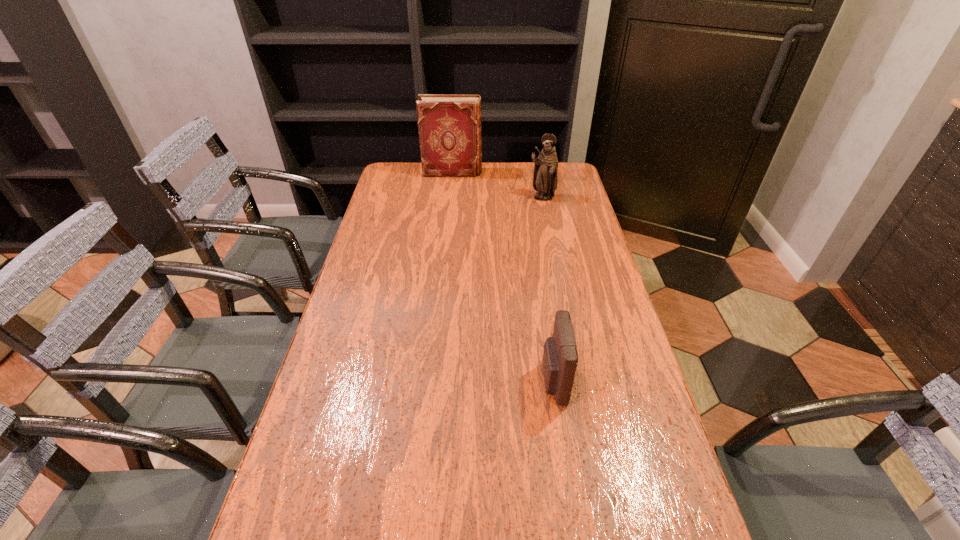
Locate an element on the screen. The height and width of the screenshot is (540, 960). the tallest object is located at coordinates (449, 126).

Locate an element on the screen. The image size is (960, 540). the farthest object is located at coordinates (449, 126).

At what (x,y) coordinates should I click in order to perform the action: click on the second tallest object. Please return your answer as a coordinate pair (x, y). This screenshot has width=960, height=540. Looking at the image, I should click on (545, 179).

You are a GUI agent. You are given a task and a screenshot of the screen. Output one action in this format:
    pyautogui.click(x=<x>, y=<y>)
    Task: Click on the second farthest object
    
    Given the screenshot: What is the action you would take?
    pyautogui.click(x=545, y=179)

Identify the location of the shortest object. (560, 358).

Locate an element on the screen. pouch is located at coordinates (560, 358).

At what (x,y) coordinates should I click in order to perform the action: click on free space located 0.250m on the spine side of the hardback book. Please return your answer as a coordinate pair (x, y). Image resolution: width=960 pixels, height=540 pixels. Looking at the image, I should click on (540, 172).

Where is `vacant space located on the front-facing side of the figurine`? The width and height of the screenshot is (960, 540). vacant space located on the front-facing side of the figurine is located at coordinates (546, 219).

The image size is (960, 540). Identify the location of vacant space situated 0.290m with an open flap on the pouch. (421, 382).

Locate an element on the screen. Image resolution: width=960 pixels, height=540 pixels. free spot located with an open flap on the pouch is located at coordinates (380, 382).